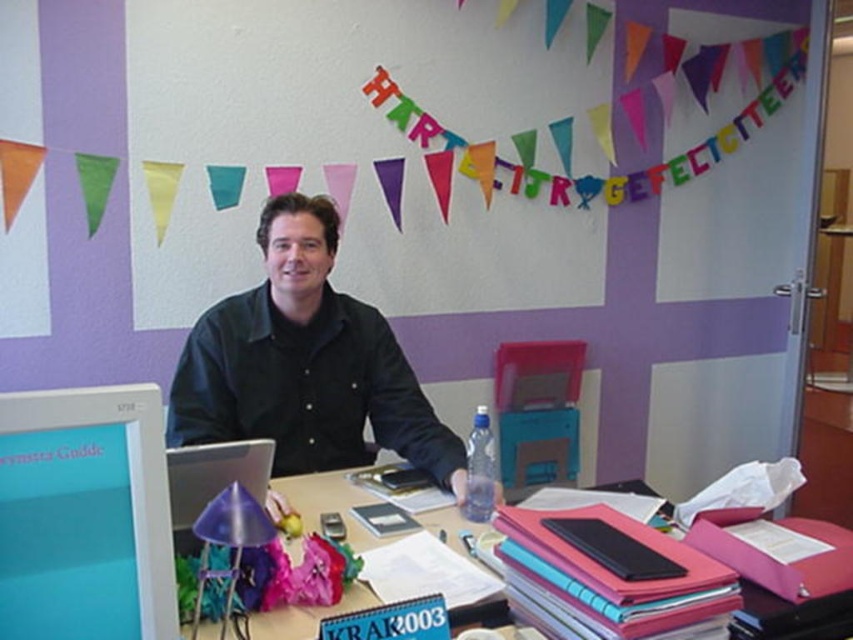
You are standing in front of the desk in the image. The black matte shirt at center is part of a person sitting there. If you want to hand them a document without moving your body, can you reach them given your arm length is 2.5 feet?

The black matte shirt at center is 5.97 feet away from the viewer. Since your arm length is only 2.5 feet, you cannot reach them to hand the document without moving.

You are standing in the room and want to reach both the point at coordinates (260, 371) and the point at coordinates (804, 611). Which point will you reach first?

You will reach the point at coordinates (260, 371) first because it is closer to you than the point at coordinates (804, 611).